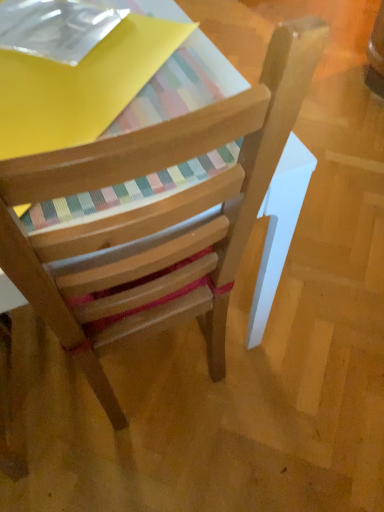
Identify the location of free space above wooden chair at center (from a real-world perspective). (87, 68).